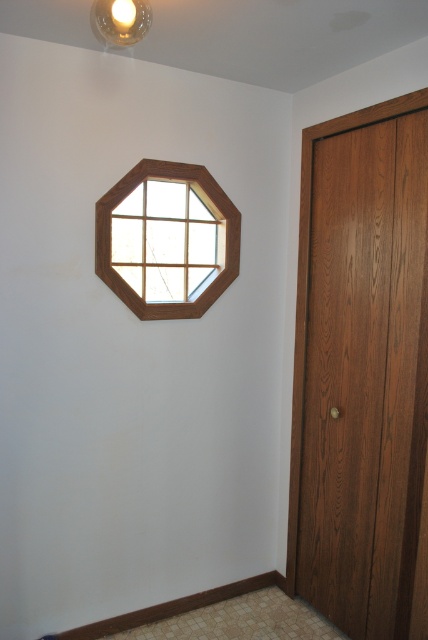
You are a painter who needs to decide whether to place a ladder next to the wooden door at right or the matte white bulb at upper center. Since you want to reach something that is taller, which object should you place the ladder next to?

The wooden door at right is taller than the matte white bulb at upper center, so you should place the ladder next to the wooden door at right.